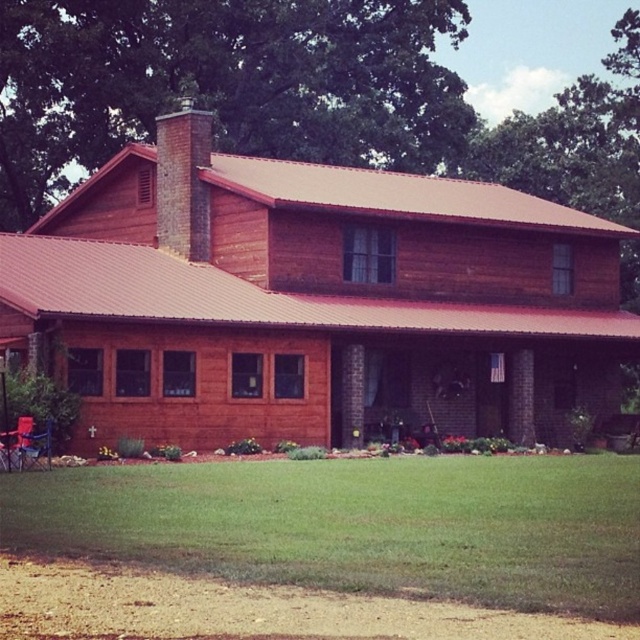
Question: Which point is closer to the camera?

Choices:
 (A) wooden cabin at center
 (B) brick chimney at upper center
 (C) green grass at lower center

Answer: (C)

Question: Is wooden cabin at center thinner than green grass at lower center?

Choices:
 (A) yes
 (B) no

Answer: (B)

Question: Among these objects, which one is nearest to the camera?

Choices:
 (A) green grass at lower center
 (B) brick chimney at upper center

Answer: (A)

Question: Does wooden cabin at center have a greater width compared to green grass at lower center?

Choices:
 (A) yes
 (B) no

Answer: (A)

Question: Estimate the real-world distances between objects in this image. Which object is closer to the green grass at lower center?

Choices:
 (A) wooden cabin at center
 (B) brick chimney at upper center

Answer: (A)

Question: Does wooden cabin at center have a smaller size compared to brick chimney at upper center?

Choices:
 (A) no
 (B) yes

Answer: (A)